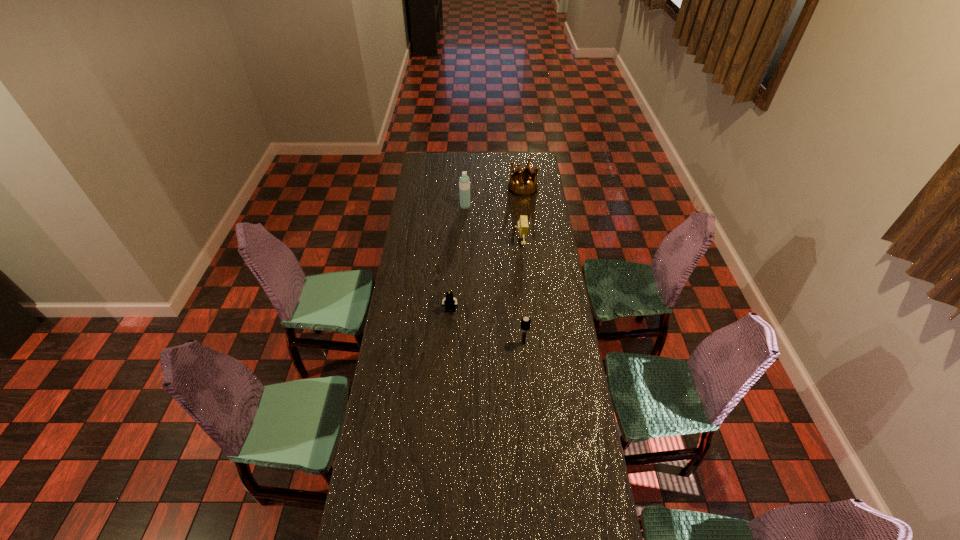
Identify the location of the tallest object. The width and height of the screenshot is (960, 540). (464, 182).

At what (x,y) coordinates should I click in order to perform the action: click on water bottle. Please return your answer as a coordinate pair (x, y). Looking at the image, I should click on (464, 182).

The width and height of the screenshot is (960, 540). I want to click on the farthest object, so click(517, 188).

This screenshot has width=960, height=540. What are the coordinates of `the nearest object` in the screenshot? It's located at [525, 325].

The image size is (960, 540). Find the location of `the third farthest object`. the third farthest object is located at coordinates (523, 226).

This screenshot has height=540, width=960. What are the coordinates of `the shortest object` in the screenshot? It's located at (450, 301).

Where is `Lego`? The width and height of the screenshot is (960, 540). Lego is located at coordinates coord(450,301).

Find the location of `vacant space located on the left of the water bottle`. vacant space located on the left of the water bottle is located at coordinates (443, 206).

Locate an element on the screen. The image size is (960, 540). free point located 0.100m on the left of the crown is located at coordinates (492, 188).

The height and width of the screenshot is (540, 960). In order to click on vacant space located 0.350m on the left of the hairbrush in this screenshot , I will do `click(434, 343)`.